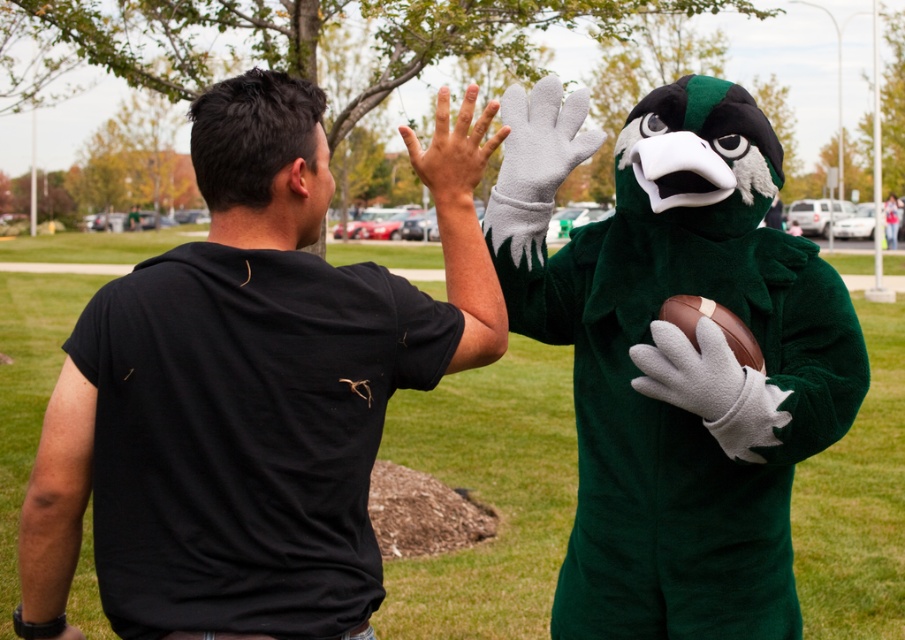
Question: Based on their relative distances, which object is farther from the gray fleece glove at lower center?

Choices:
 (A) black matte t-shirt at upper left
 (B) white fleece glove at center

Answer: (A)

Question: Does white fleece glove at center have a lesser width compared to smooth skin hand at center?

Choices:
 (A) yes
 (B) no

Answer: (A)

Question: Observing the image, what is the correct spatial positioning of black matte t-shirt at upper left in reference to smooth skin hand at center?

Choices:
 (A) right
 (B) left

Answer: (B)

Question: Considering the real-world distances, which object is closest to the smooth skin hand at center?

Choices:
 (A) black matte t-shirt at upper left
 (B) gray fleece glove at lower center

Answer: (B)

Question: Observing the image, what is the correct spatial positioning of black matte t-shirt at upper left in reference to smooth skin hand at center?

Choices:
 (A) right
 (B) left

Answer: (B)

Question: Which object is positioned closest to the gray fleece glove at lower center?

Choices:
 (A) smooth skin hand at center
 (B) black matte t-shirt at upper left
 (C) white fleece glove at center

Answer: (C)